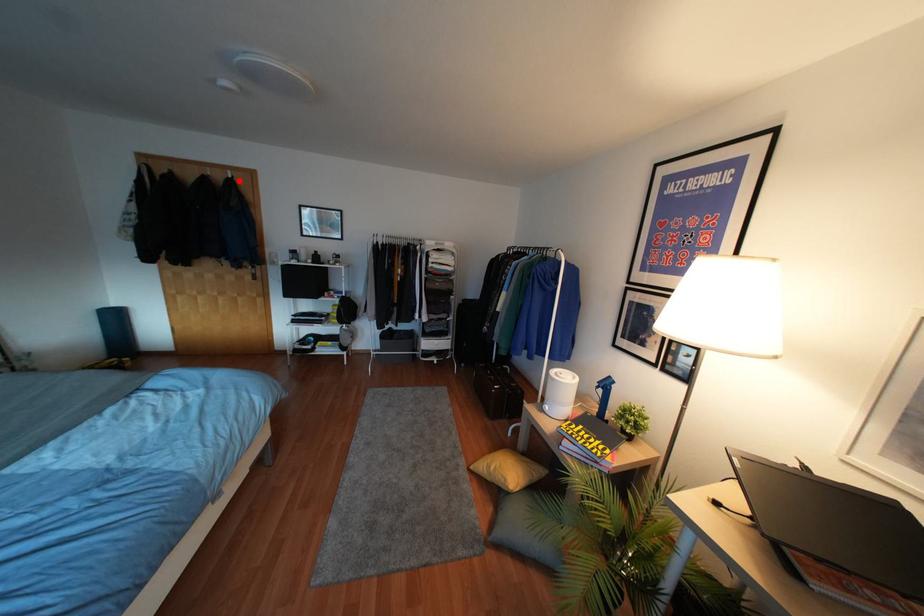
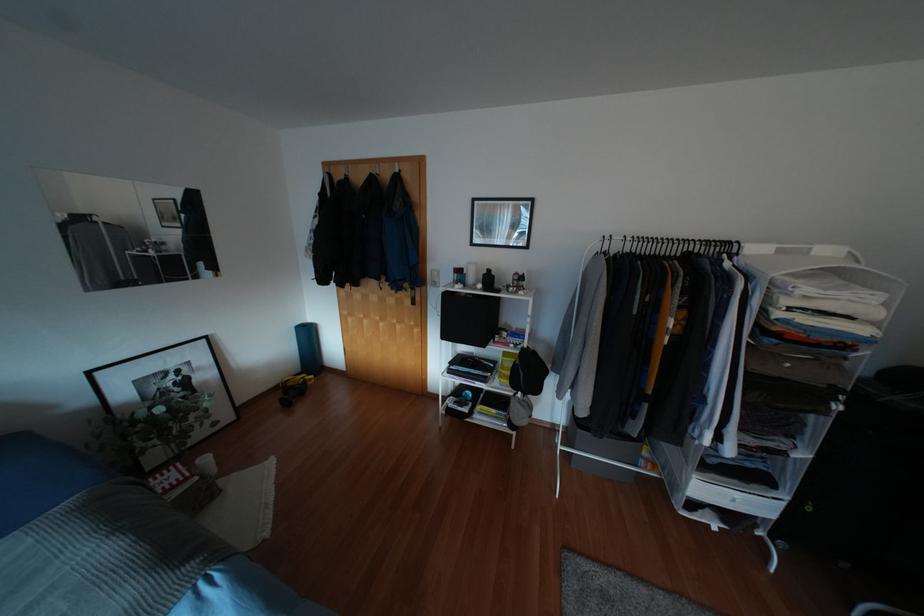
In the second image, find the point that corresponds to the highlighted location in the first image.

(406, 176)